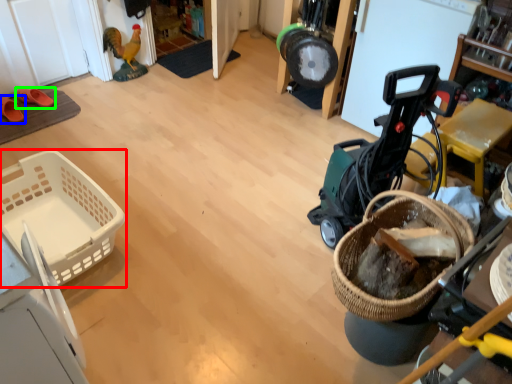
Question: Which is nearer to the basket (highlighted by a red box)? footwear (highlighted by a blue box) or footwear (highlighted by a green box).

Choices:
 (A) footwear
 (B) footwear

Answer: (A)